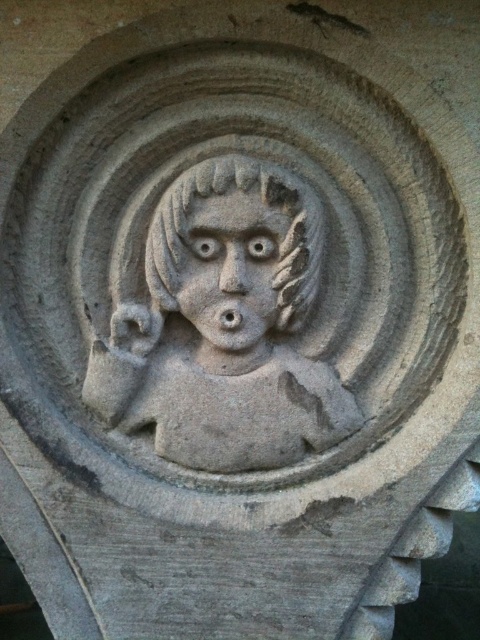
You are standing in front of the stone carving and want to touch the point at coordinates point (271, 189). If your hand can reach up to 1.2 meters, will you be able to reach it?

The distance of point (271, 189) from viewer is 1.37 meters, so your hand cannot reach it since it is further away than your maximum reach of 1.2 meters.

Based on the scene description, which object is taller between the gray stone deity at center and the stone textured face at center?

The gray stone deity at center is much taller than the stone textured face at center.